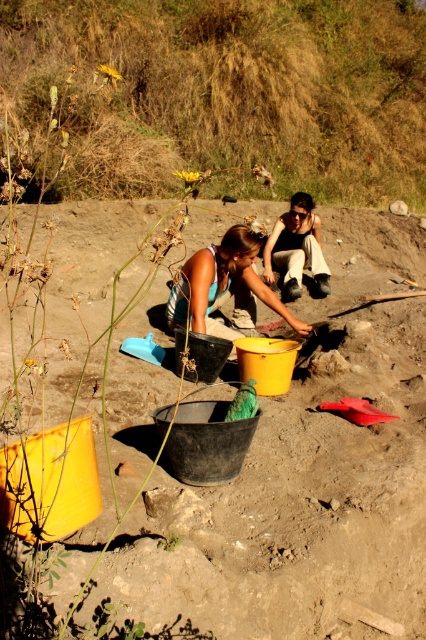
Question: Which point is closer to the camera taking this photo?

Choices:
 (A) (238, 320)
 (B) (282, 291)
 (C) (129, 184)

Answer: (A)

Question: Which of these objects is positioned farthest from the yellow matte bucket at center?

Choices:
 (A) matte black pants at center
 (B) brown grassy hillside at upper center

Answer: (B)

Question: Can you confirm if yellow matte bucket at center is wider than matte blue tank top at center?

Choices:
 (A) yes
 (B) no

Answer: (B)

Question: Is brown grassy hillside at upper center further to the viewer compared to matte black pants at center?

Choices:
 (A) yes
 (B) no

Answer: (B)

Question: Which point is closer to the camera?

Choices:
 (A) (273, 234)
 (B) (307, 476)
 (C) (48, 145)

Answer: (B)

Question: Is yellow matte bucket at center above matte black pants at center?

Choices:
 (A) no
 (B) yes

Answer: (A)